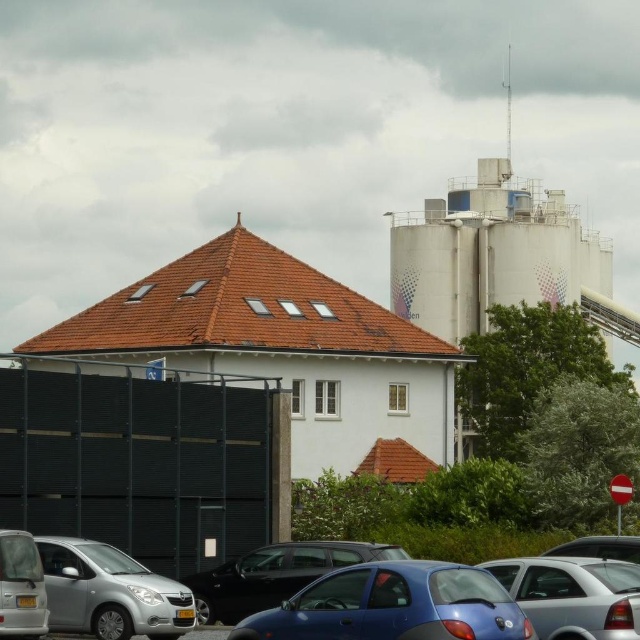
You are a delivery person trying to park your truck between the silver metallic hatchback at lower left and the metallic blue sedan at center. Your truck is 2 meters tall. Can you park there without hitting the roof?

The silver metallic hatchback at lower left is taller than the metallic blue sedan at center. Since the hatchback is taller, the parking space between them might have a height restriction. However, the exact height of the hatchback isn not provided. Without knowing the exact height, it is impossible to determine if your 2 meter tall truck can fit safely.

You are a delivery person trying to park your van in the parking area. You notice two silver cars in the lot. Which one takes up more space in the parking area? The silver metallic hatchback at lower left or the metallic silver car at lower right?

The metallic silver car at lower right takes up more space in the parking area because it is larger than the silver metallic hatchback at lower left.

You are a delivery person trying to park your truck in the parking area. You see the silver metallic hatchback at lower left and the metallic blue sedan at center. Which vehicle should you move first to access the parking spot behind them?

You should move the metallic blue sedan at center first because the silver metallic hatchback at lower left is closer to you, so you would need to move the farther vehicle first to access the parking spot behind them.